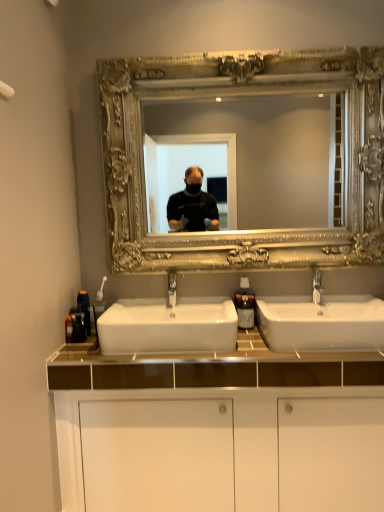
What are the coordinates of `vacant area to the right of silver metallic faucet at center` in the screenshot? It's located at (344, 309).